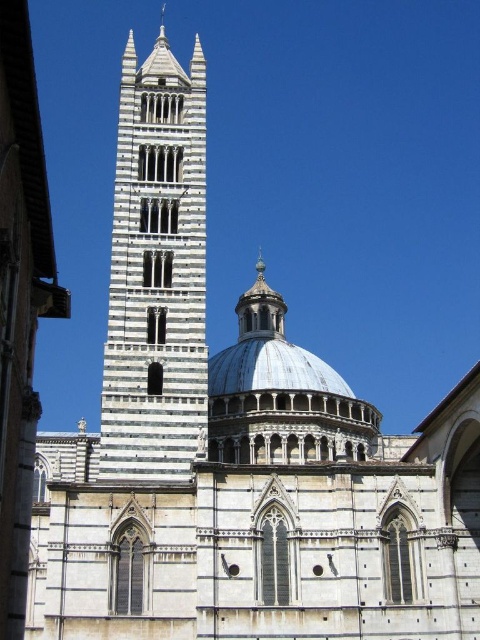
You are an architect visiting this historical site and want to compare the sizes of the two main structures. Based on the image, which one is larger between the white marble tower at center and the metallic silver dome at center?

The white marble tower at center is bigger than the metallic silver dome at center, so the white marble tower at center is larger.

You are standing in front of the cathedral and want to take a photo that includes both the white marble tower at center and the tall bell tower on the left. Based on their positions, which tower should you position closer to the left side of your camera frame?

The white marble tower at center is located at point (156, 272), which is to the right of the tall bell tower on the left. Therefore, to include both in the photo, you should position the white marble tower at center closer to the right side and the tall bell tower on the left closer to the left side of your camera frame.

You are an architect planning to install a new flagpole on the tallest structure in the image. Which object should you choose between the white marble tower at center and the metallic silver dome at center?

The white marble tower at center is taller than the metallic silver dome at center, so you should install the flagpole on the white marble tower at center.